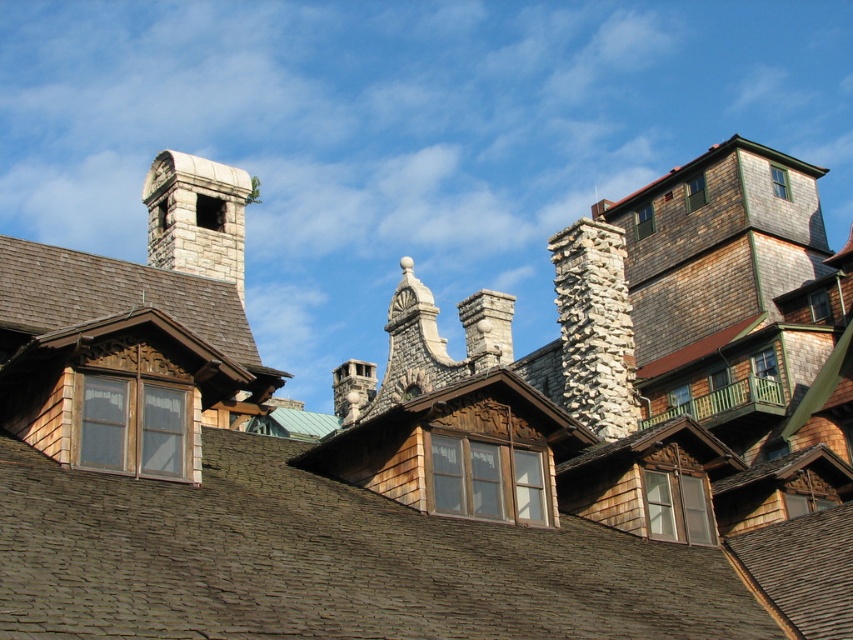
Is point (558, 246) closer to camera compared to point (190, 200)?

No, it is not.

Is stone chimney at center-right to the left of stone chimney at upper left from the viewer's perspective?

In fact, stone chimney at center-right is to the right of stone chimney at upper left.

Is point (605, 384) in front of point (198, 216)?

No.

Find the location of `stone chimney at center-right`. stone chimney at center-right is located at coordinates (595, 326).